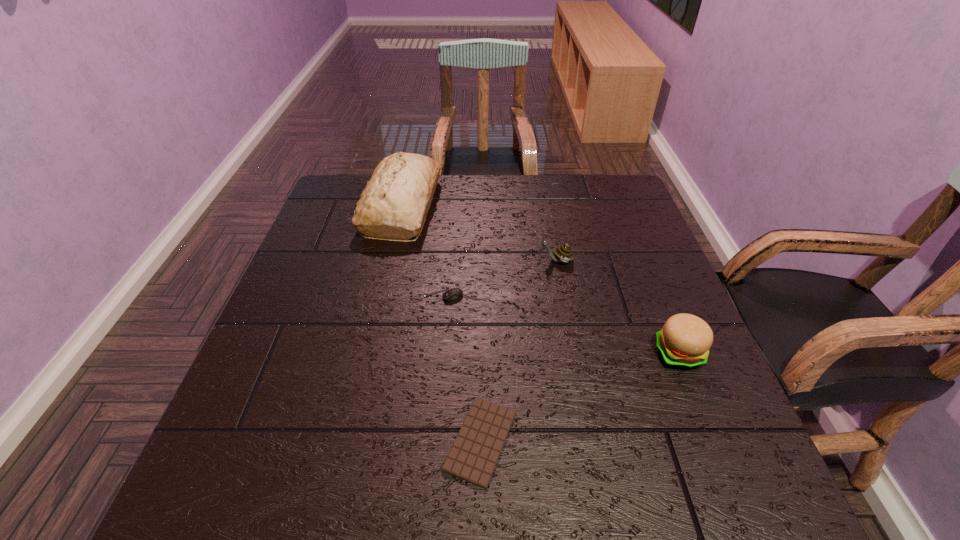
Locate an element on the screen. This screenshot has height=540, width=960. unoccupied position between the nearest object and the farthest object is located at coordinates (442, 323).

What are the coordinates of `free space that is in between the third nearest object and the fourth nearest object` in the screenshot? It's located at (500, 279).

The width and height of the screenshot is (960, 540). Identify the location of vacant space that is in between the mouse and the fourth object from left to right. (500, 279).

The height and width of the screenshot is (540, 960). In order to click on vacant region between the fourth farthest object and the second shortest object in this screenshot , I will do `click(561, 325)`.

The width and height of the screenshot is (960, 540). Find the location of `free area in between the tallest object and the mouse`. free area in between the tallest object and the mouse is located at coordinates (423, 251).

Find the location of a particular element. unoccupied area between the second farthest object and the shortest object is located at coordinates (518, 350).

This screenshot has width=960, height=540. I want to click on vacant area that lies between the bread and the second object from right to left, so click(479, 233).

The width and height of the screenshot is (960, 540). Find the location of `the second closest object to the shortest object`. the second closest object to the shortest object is located at coordinates (684, 342).

Select which object is the closest to the hamburger. Please provide its 2D coordinates. Your answer should be formatted as a tuple, i.e. [(x, y)], where the tuple contains the x and y coordinates of a point satisfying the conditions above.

[(563, 253)]

The height and width of the screenshot is (540, 960). I want to click on vacant area that satisfies the following two spatial constraints: 1. on the face of the fourth nearest object; 2. on the right side of the second nearest object, so pos(574,353).